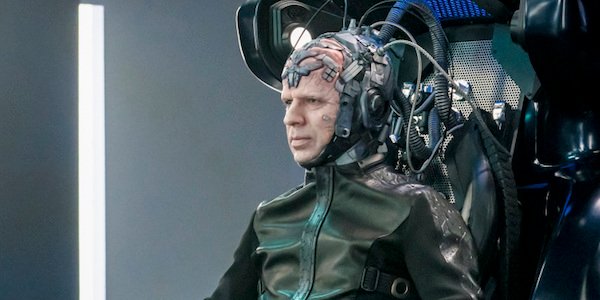
Locate an element on the screen. The height and width of the screenshot is (300, 600). cables is located at coordinates (381, 44), (405, 31), (397, 108).